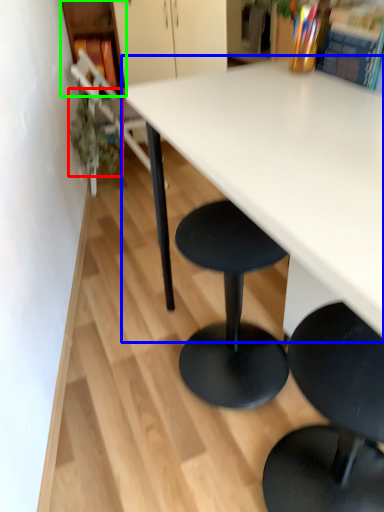
Question: Which is nearer to the plant (highlighted by a red box)? table (highlighted by a blue box) or shelf (highlighted by a green box).

Choices:
 (A) table
 (B) shelf

Answer: (B)